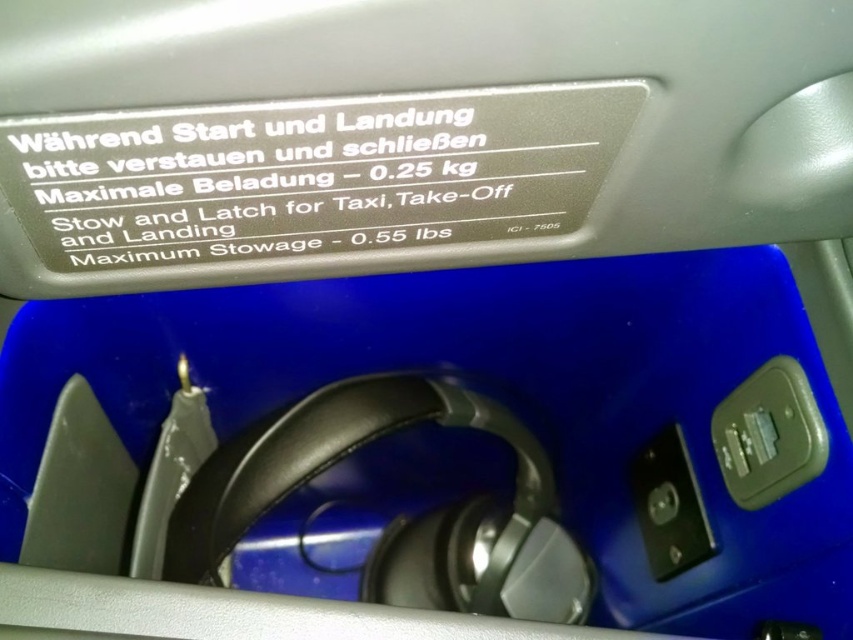
What is the location of the point marked at coordinates (x=769, y=435) in the storage compartment?

The point marked at coordinates (x=769, y=435) corresponds to the matte gray speaker located at the upper right of the storage compartment.

You are a flight attendant checking the storage compartment. You need to retrieve the matte gray speaker at upper right and the metallic silver speaker at lower right. Which speaker will you reach first?

The matte gray speaker at upper right is closer to the viewer than the metallic silver speaker at lower right, so you will reach the matte gray speaker at upper right first.

You are a flight attendant checking the storage compartment. You need to place a 12 inch long carryon bag in the compartment. The compartment has a matte gray speaker at upper right. Is there enough space between the speaker and the viewer to fit the bag?

The matte gray speaker at upper right and viewer are 18.91 inches apart from each other. Since the carryon bag is 12 inches long, there is sufficient space to fit it between the speaker and the viewer in the compartment.